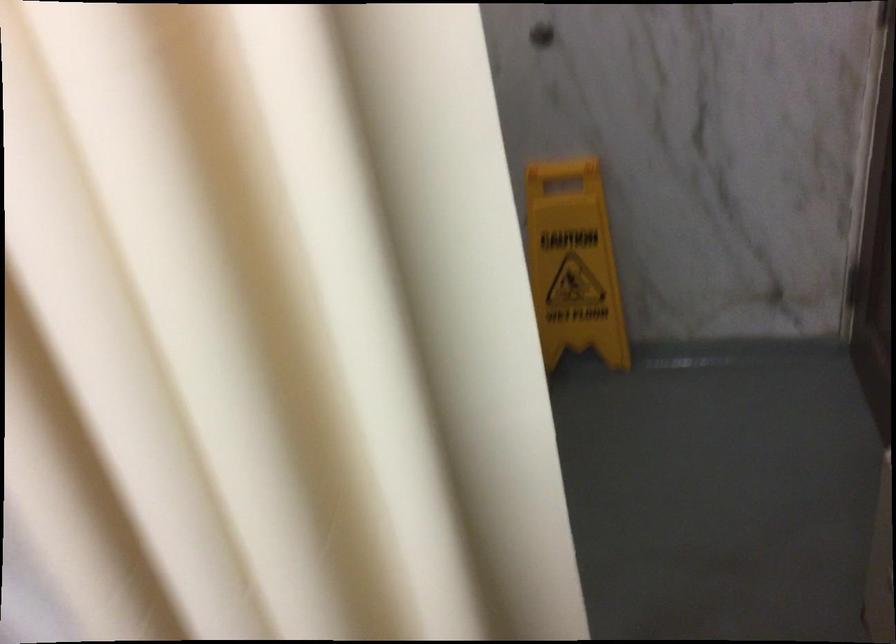
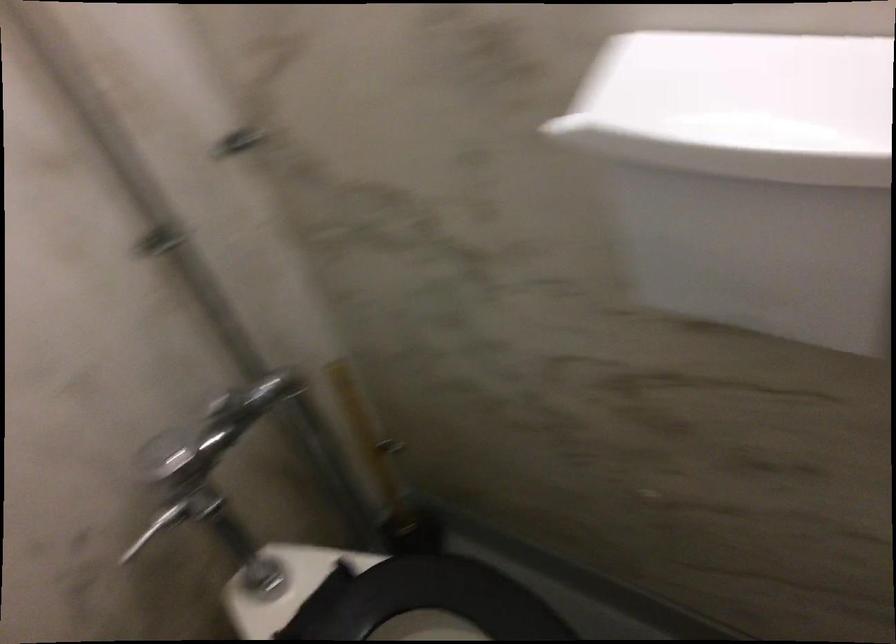
First-person continuous shooting, in which direction is the camera rotating?

The rotation direction of the camera is left-down.